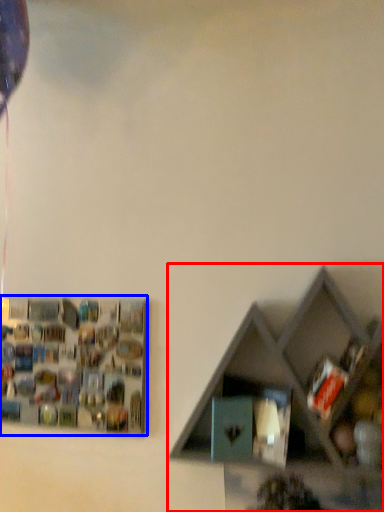
Question: Among these objects, which one is nearest to the camera, shelf (highlighted by a red box) or shelf (highlighted by a blue box)?

Choices:
 (A) shelf
 (B) shelf

Answer: (A)